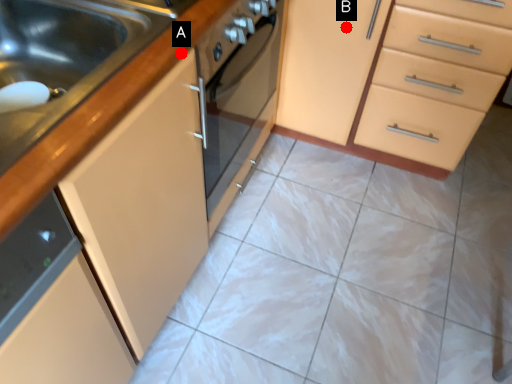
Question: Two points are circled on the image, labeled by A and B beside each circle. Which point appears closest to the camera in this image?

Choices:
 (A) A is closer
 (B) B is closer

Answer: (A)